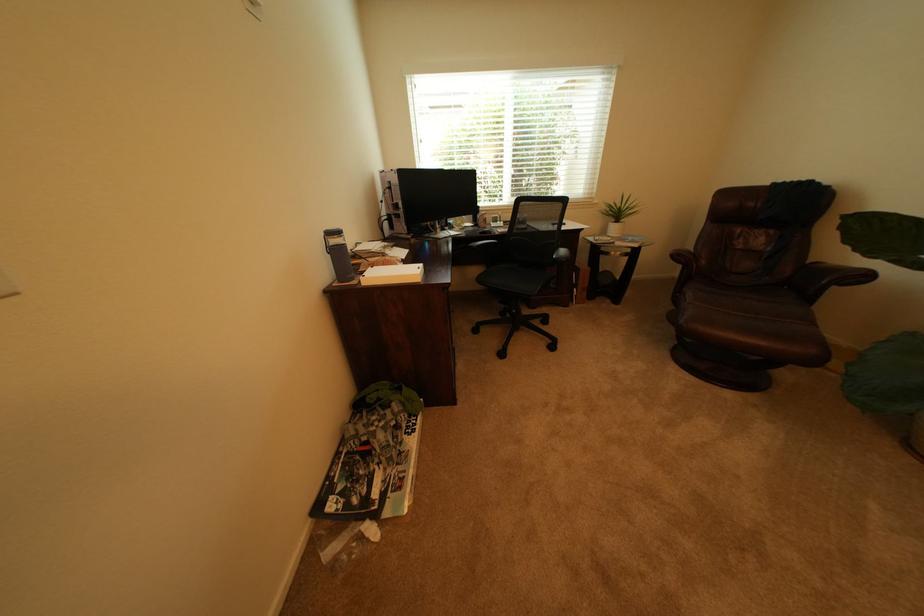
This screenshot has height=616, width=924. I want to click on brown recliner sitting surface, so click(x=748, y=320).